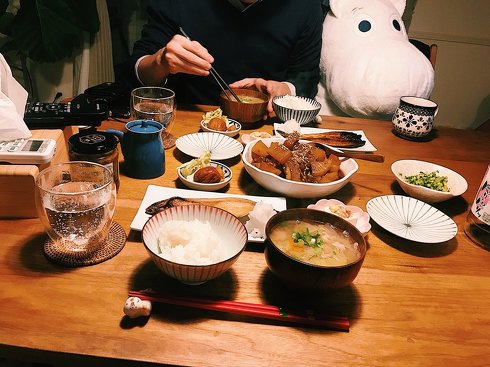
The height and width of the screenshot is (367, 490). What are the coordinates of `teacup` in the screenshot? It's located at (406, 121).